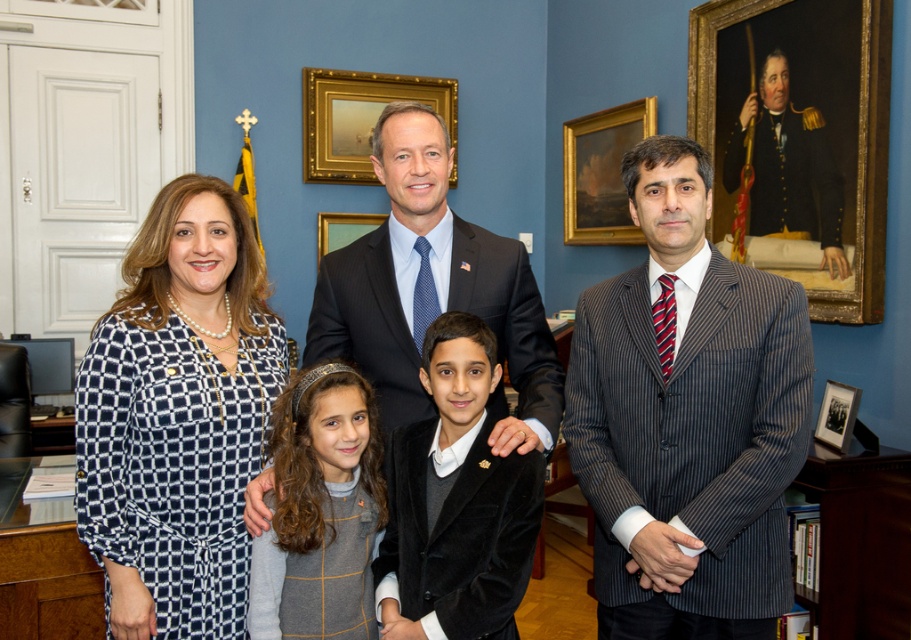
Between striped wool suit at center and checkered fabric dress at left, which one appears on the left side from the viewer's perspective?

checkered fabric dress at left

Between striped wool suit at center and checkered fabric dress at left, which one has more height?

Standing taller between the two is striped wool suit at center.

The width and height of the screenshot is (911, 640). What do you see at coordinates (687, 419) in the screenshot?
I see `striped wool suit at center` at bounding box center [687, 419].

Locate an element on the screen. This screenshot has width=911, height=640. striped wool suit at center is located at coordinates (687, 419).

Which is behind, point (142, 310) or point (367, 157)?

Positioned behind is point (367, 157).

Is checkered fabric dress at left positioned behind goldwooden frame at upper center?

No, checkered fabric dress at left is closer to the viewer.

The width and height of the screenshot is (911, 640). In order to click on checkered fabric dress at left in this screenshot , I will do `click(370, 337)`.

Locate an element on the screen. The height and width of the screenshot is (640, 911). checkered fabric dress at left is located at coordinates (370, 337).

Does checkered fabric dress at left lie behind dark blue pinstripe suit at center?

That is False.

Which is above, checkered fabric dress at left or dark blue pinstripe suit at center?

dark blue pinstripe suit at center is higher up.

Between point (408, 380) and point (339, 340), which one is positioned in front?

Positioned in front is point (408, 380).

Image resolution: width=911 pixels, height=640 pixels. Identify the location of checkered fabric dress at left. (370, 337).